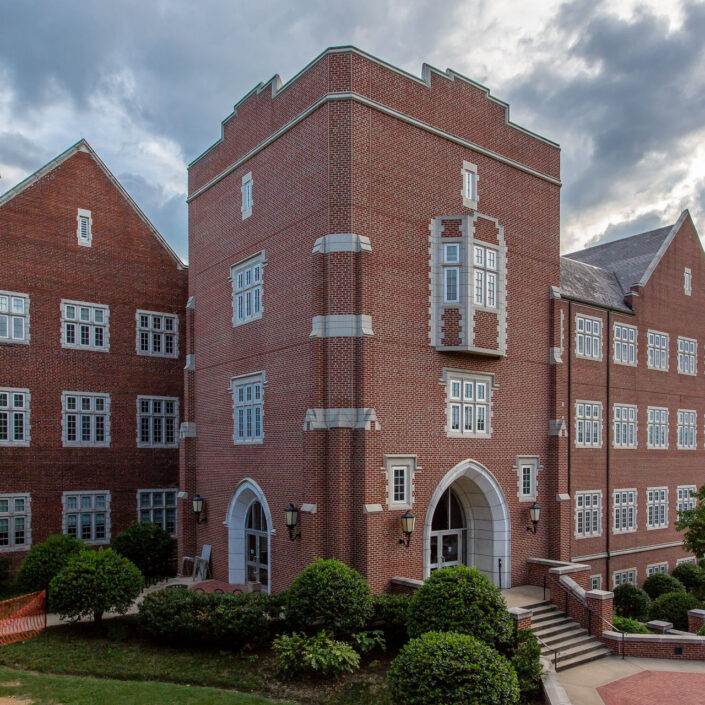
At what (x,y) coordinates should I click in order to perform the action: click on lower windows. Please return your answer as a coordinate pair (x, y). This screenshot has height=705, width=705. Looking at the image, I should click on click(685, 560), click(655, 574), click(623, 577), click(591, 581).